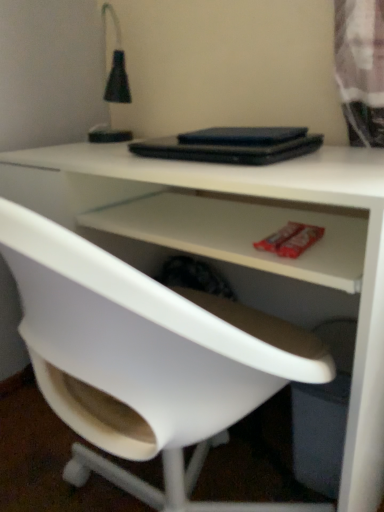
Question: Is black matte table lamp at upper left in front of or behind black matte laptop at center in the image?

Choices:
 (A) behind
 (B) front

Answer: (A)

Question: Is black matte table lamp at upper left taller or shorter than black matte laptop at center?

Choices:
 (A) tall
 (B) short

Answer: (A)

Question: Which object is positioned closest to the black matte laptop at center?

Choices:
 (A) black matte table lamp at upper left
 (B) white plastic chair at center

Answer: (A)

Question: Estimate the real-world distances between objects in this image. Which object is closer to the black matte table lamp at upper left?

Choices:
 (A) black matte laptop at center
 (B) white plastic chair at center

Answer: (A)